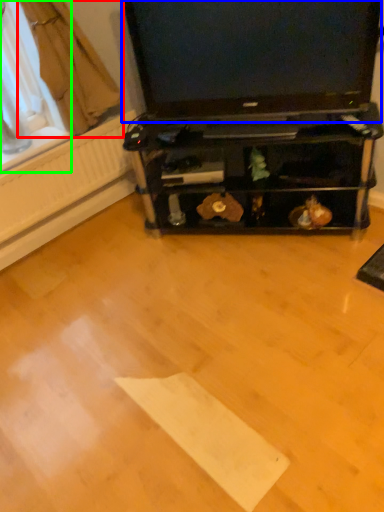
Question: Which object is positioned farthest from curtain (highlighted by a red box)? Select from television (highlighted by a blue box) and window screen (highlighted by a green box).

Choices:
 (A) television
 (B) window screen

Answer: (A)